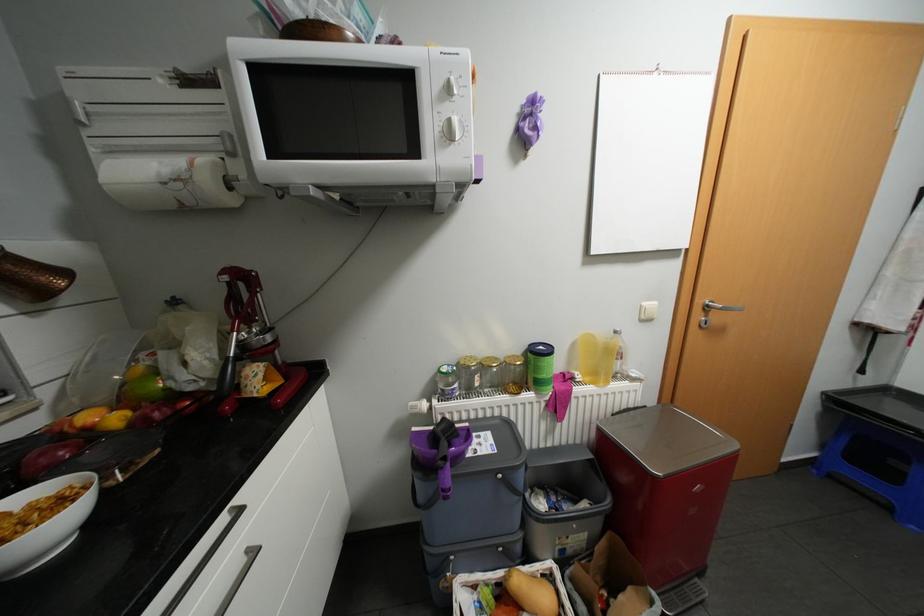
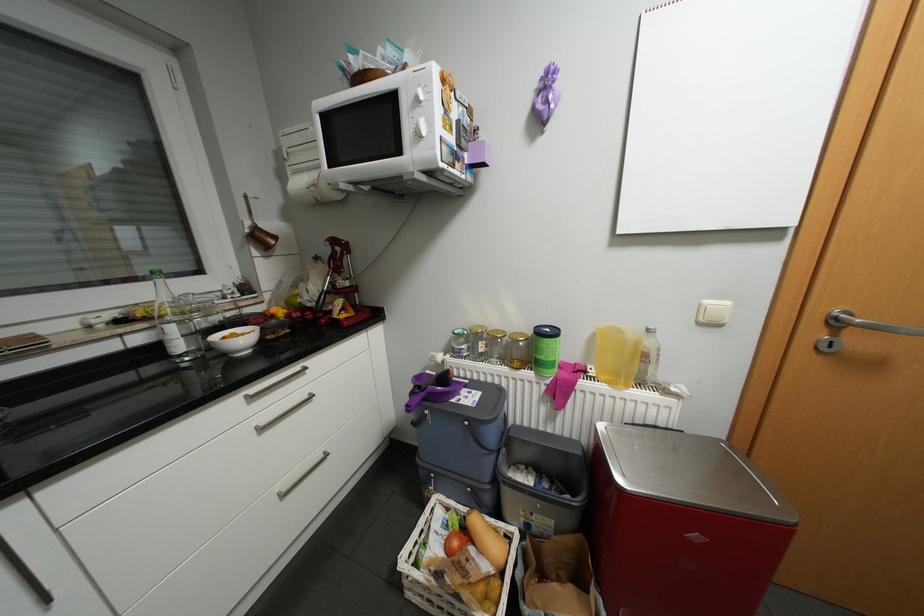
Question: What movement of the cameraman would produce the second image?

Choices:
 (A) Left
 (B) Right
 (C) Forward
 (D) Backward

Answer: (B)